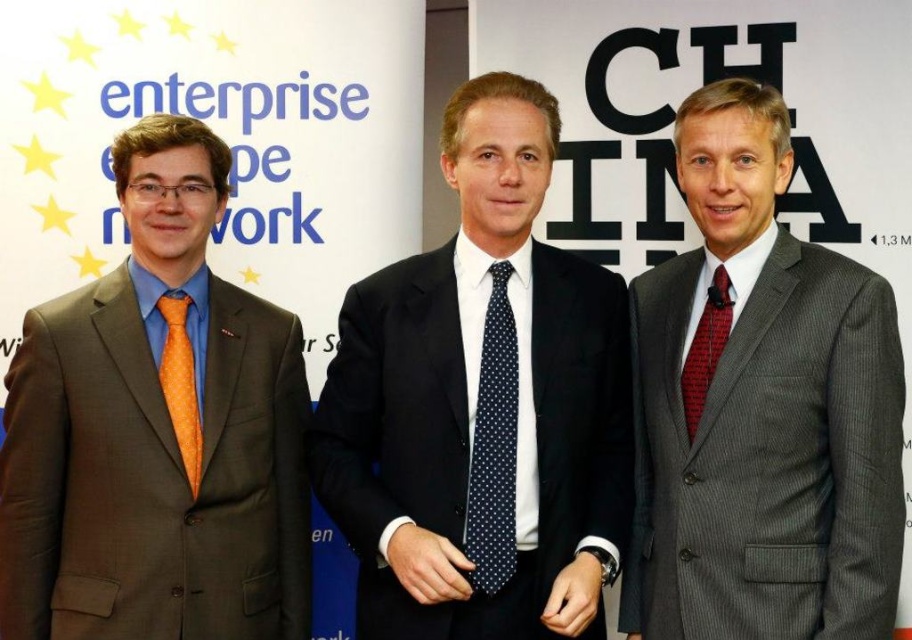
Does orange silk tie at left have a greater height compared to red woven tie at right?

Yes.

Is point (261, 432) closer to viewer compared to point (684, 403)?

No, it is not.

Is point (195, 260) positioned in front of point (721, 348)?

No.

You are a GUI agent. You are given a task and a screenshot of the screen. Output one action in this format:
    pyautogui.click(x=<x>, y=<y>)
    Task: Click on the orange silk tie at left
    The width and height of the screenshot is (912, 640).
    Given the screenshot: What is the action you would take?
    pyautogui.click(x=157, y=432)

Is the position of dark blue polka dot tie at center more distant than that of gray pinstripe suit at right?

Yes, dark blue polka dot tie at center is behind gray pinstripe suit at right.

Does dark blue polka dot tie at center appear on the right side of gray pinstripe suit at right?

Incorrect, dark blue polka dot tie at center is not on the right side of gray pinstripe suit at right.

Where is `dark blue polka dot tie at center`? The image size is (912, 640). dark blue polka dot tie at center is located at coordinates (482, 404).

Can you confirm if gray pinstripe suit at right is positioned below orange dotted tie at left?

Actually, gray pinstripe suit at right is above orange dotted tie at left.

Does gray pinstripe suit at right have a lesser height compared to orange dotted tie at left?

No.

This screenshot has width=912, height=640. In order to click on gray pinstripe suit at right in this screenshot , I will do `click(760, 408)`.

I want to click on gray pinstripe suit at right, so click(760, 408).